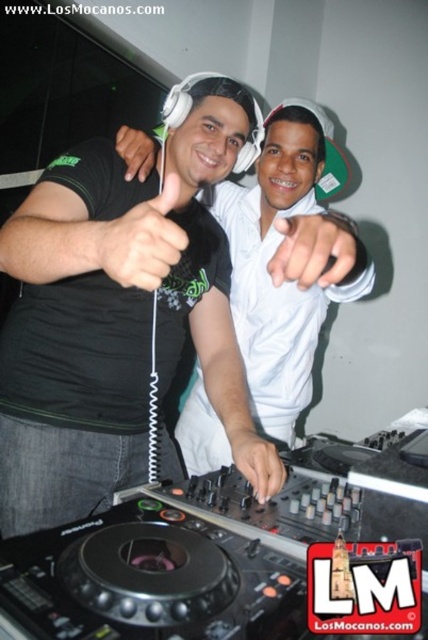
Measure the distance between matte black headphones at center and camera.

24.46 inches

Which is above, matte black headphones at center or matte black hand at upper center?

matte black hand at upper center is above.

What do you see at coordinates (113, 310) in the screenshot? I see `matte black headphones at center` at bounding box center [113, 310].

Identify the location of matte black headphones at center. (113, 310).

Can you confirm if black matte hand at center is positioned to the left of matte black hand at upper center?

Incorrect, black matte hand at center is not on the left side of matte black hand at upper center.

From the picture: Is black matte hand at center below matte black hand at upper center?

Yes, black matte hand at center is below matte black hand at upper center.

Is point (252, 436) in front of point (121, 131)?

Yes, point (252, 436) is in front of point (121, 131).

Locate an element on the screen. This screenshot has width=428, height=640. black matte hand at center is located at coordinates (256, 461).

Who is positioned more to the right, white matte hand at center or black matte hand at center?

white matte hand at center

Does white matte hand at center appear under black matte hand at center?

No, white matte hand at center is not below black matte hand at center.

The height and width of the screenshot is (640, 428). Identify the location of white matte hand at center. (312, 250).